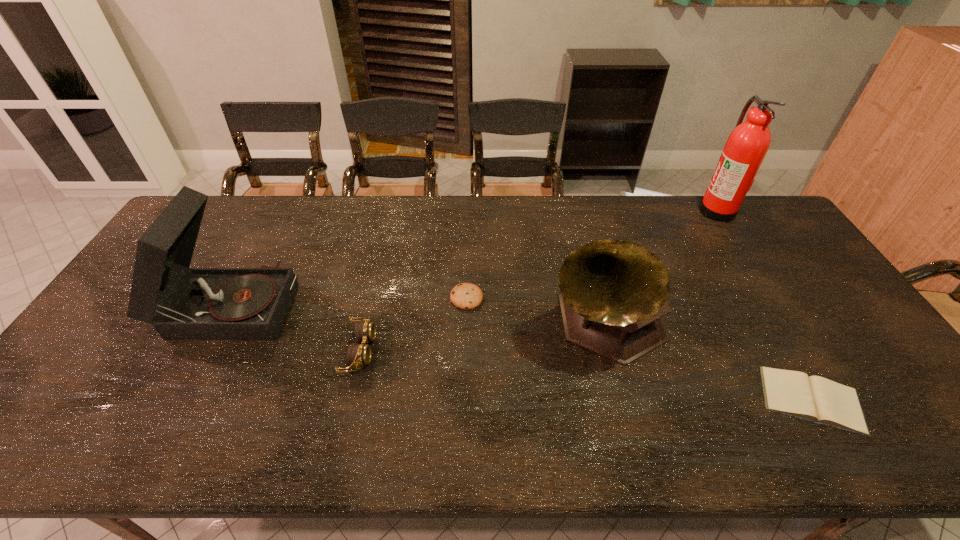
The image size is (960, 540). Identify the location of free point between the left phonograph record and the shortest object. (521, 352).

At what (x,y) coordinates should I click in order to perform the action: click on free space between the second object from left to right and the right phonograph record. Please return your answer as a coordinate pair (x, y). This screenshot has width=960, height=540. Looking at the image, I should click on (482, 337).

Locate an element on the screen. This screenshot has width=960, height=540. vacant space that is in between the Bible and the tallest object is located at coordinates (764, 305).

Locate an element on the screen. The height and width of the screenshot is (540, 960). vacant region between the third object from right to left and the shortest object is located at coordinates click(708, 361).

The height and width of the screenshot is (540, 960). Find the location of `unoccupied position between the fourth object from left to right and the cookie`. unoccupied position between the fourth object from left to right and the cookie is located at coordinates (536, 310).

Find the location of `free spot between the Bible and the farthest object`. free spot between the Bible and the farthest object is located at coordinates (764, 305).

Where is `the third closest object to the second shortest object`? This screenshot has height=540, width=960. the third closest object to the second shortest object is located at coordinates (182, 303).

Where is `the closest object relative to the fourth object from left to right`? The image size is (960, 540). the closest object relative to the fourth object from left to right is located at coordinates (817, 399).

I want to click on free space that satisfies the following two spatial constraints: 1. on the label side of the tallest object; 2. on the front side of the shortest object, so click(x=836, y=400).

The height and width of the screenshot is (540, 960). I want to click on free space in the image that satisfies the following two spatial constraints: 1. on the horn direction of the right phonograph record; 2. through the lenses of the goggles, so tap(612, 351).